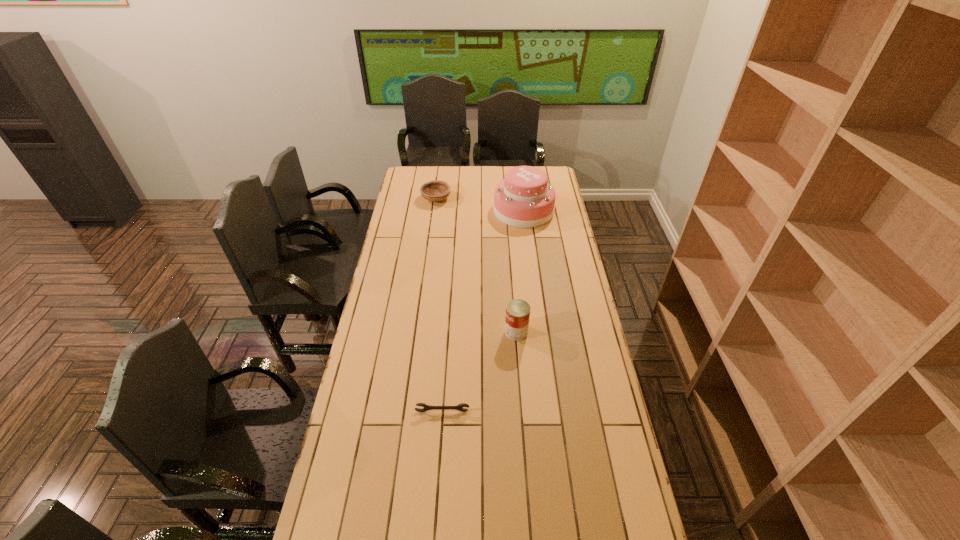
Where is `free space located 0.100m on the left of the bowl`? free space located 0.100m on the left of the bowl is located at coordinates (403, 199).

This screenshot has height=540, width=960. I want to click on free space located on the open ends of the nearest object, so click(435, 517).

Where is `object that is at the left edge`? The height and width of the screenshot is (540, 960). object that is at the left edge is located at coordinates (436, 190).

This screenshot has width=960, height=540. Find the location of `object at the right edge`. object at the right edge is located at coordinates (524, 199).

At what (x,y) coordinates should I click in order to perform the action: click on vacant space at the far edge. Please return your answer as a coordinate pair (x, y). Looking at the image, I should click on (501, 173).

This screenshot has width=960, height=540. I want to click on free space at the left edge of the desktop, so click(x=349, y=440).

Where is `vacant space at the right edge`? This screenshot has width=960, height=540. vacant space at the right edge is located at coordinates (569, 303).

Find the location of a particular element. This screenshot has width=960, height=540. free region at the far left corner of the desktop is located at coordinates (411, 180).

In order to click on free space at the far right corner of the desktop in this screenshot , I will do `click(550, 179)`.

Identify the location of free spot between the bowl and the wrench. (440, 305).